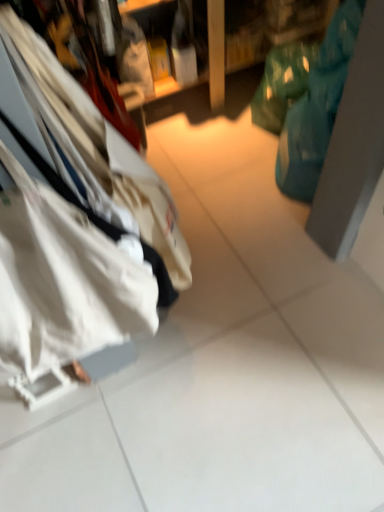
The height and width of the screenshot is (512, 384). Identify the location of blank area beneath white fabric tote at left (from a real-world perspective). (139, 394).